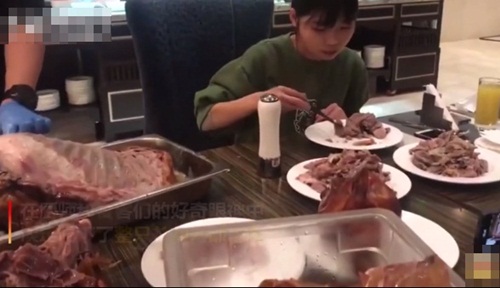
Find the location of a particular element. table is located at coordinates (266, 187).